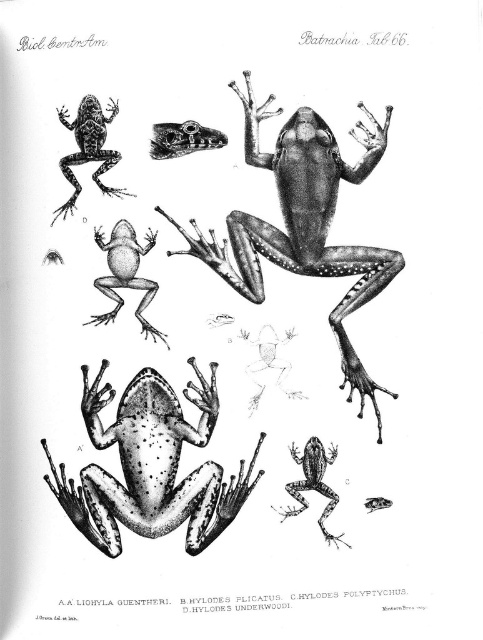
Question: Can you confirm if smooth black frog at center is smaller than speckled matte frog at center?

Choices:
 (A) no
 (B) yes

Answer: (A)

Question: Which is farther from the speckled matte frog at center?

Choices:
 (A) spotted matte frog at upper left
 (B) smooth black frog at center

Answer: (A)

Question: Does smooth black frog at center have a lesser width compared to speckled skin frog at lower right?

Choices:
 (A) yes
 (B) no

Answer: (B)

Question: From the image, what is the correct spatial relationship of spotted matte frog at upper left in relation to smooth black skull at upper center?

Choices:
 (A) right
 (B) left

Answer: (B)

Question: Which object is closer to the camera taking this photo?

Choices:
 (A) speckled matte frog at center
 (B) spotted matte frog at upper left

Answer: (B)

Question: Among these objects, which one is nearest to the camera?

Choices:
 (A) spotted matte frog at upper left
 (B) smooth black skull at upper center

Answer: (A)